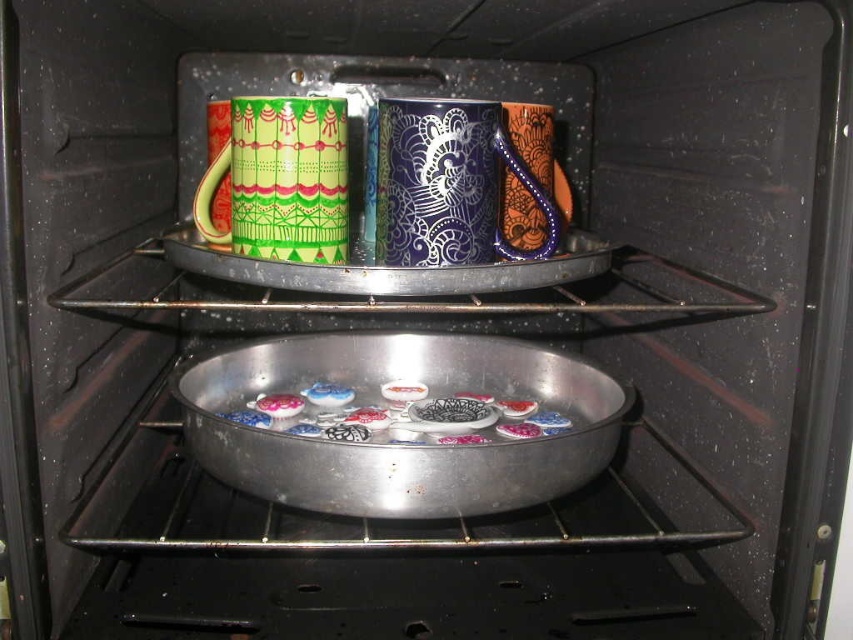
Question: From the image, what is the correct spatial relationship of shiny metallic cookies at center in relation to matte ceramic button at center?

Choices:
 (A) right
 (B) left

Answer: (B)

Question: Which is farther from the green glossy mug at upper center?

Choices:
 (A) matte ceramic button at center
 (B) shiny metallic cookies at center
 (C) matte ceramic cookie at center
 (D) glossy ceramic mug at upper center

Answer: (A)

Question: Which point is closer to the camera?

Choices:
 (A) (294, 396)
 (B) (253, 224)
 (C) (509, 435)
 (D) (509, 416)

Answer: (B)

Question: Is matte ceramic cookie at center smaller than matte ceramic button at center?

Choices:
 (A) yes
 (B) no

Answer: (B)

Question: Which is nearer to the shiny metallic cookies at center?

Choices:
 (A) green glossy mug at upper center
 (B) glossy ceramic button at center
 (C) glossy ceramic mug at upper center

Answer: (B)

Question: Does glossy ceramic mug at upper center appear under matte ceramic button at center?

Choices:
 (A) no
 (B) yes

Answer: (A)